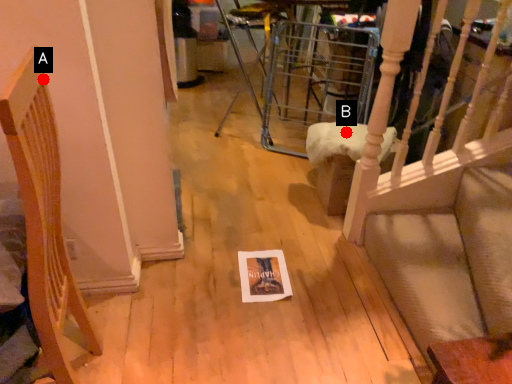
Question: Two points are circled on the image, labeled by A and B beside each circle. Which point is further to the camera?

Choices:
 (A) A is further
 (B) B is further

Answer: (B)